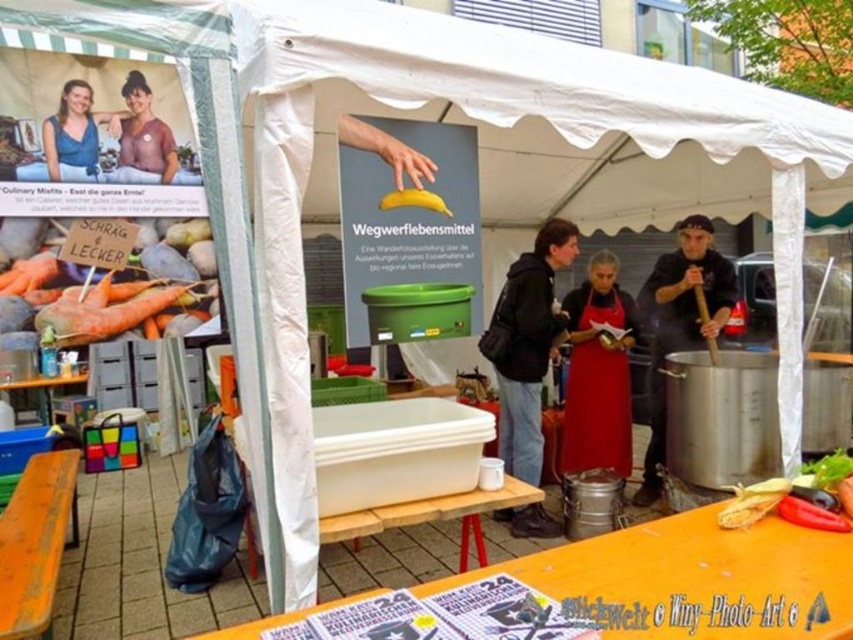
Question: Which point appears closest to the camera in this image?

Choices:
 (A) (383, 198)
 (B) (352, 339)
 (C) (550, 260)
 (D) (12, 500)

Answer: (B)

Question: Does black leather hat at center have a larger size compared to red matte pepper at lower right?

Choices:
 (A) no
 (B) yes

Answer: (B)

Question: Which point is closer to the camera?

Choices:
 (A) black leather hat at center
 (B) orange matte carrots at lower left
 (C) red matte apron at center
 (D) red matte pepper at lower right

Answer: (B)

Question: Which is farther from the orange matte table at lower center?

Choices:
 (A) red matte apron at center
 (B) matte pink shirt at upper left
 (C) red matte pepper at lower right

Answer: (A)

Question: Is matte white poster at center to the right of smooth yellow corn at lower right from the viewer's perspective?

Choices:
 (A) no
 (B) yes

Answer: (A)

Question: Can you confirm if black leather hat at center is bigger than wooden bench at lower left?

Choices:
 (A) yes
 (B) no

Answer: (B)